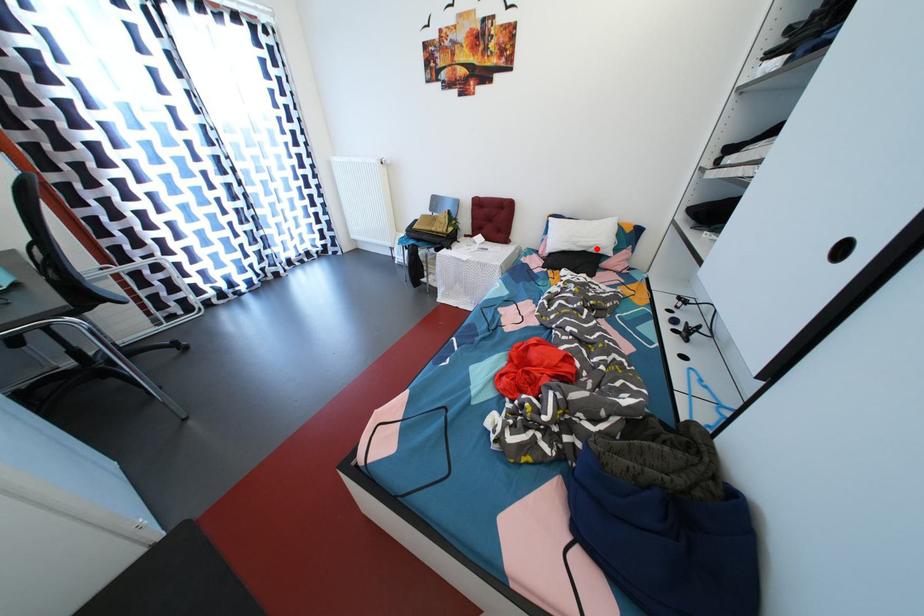
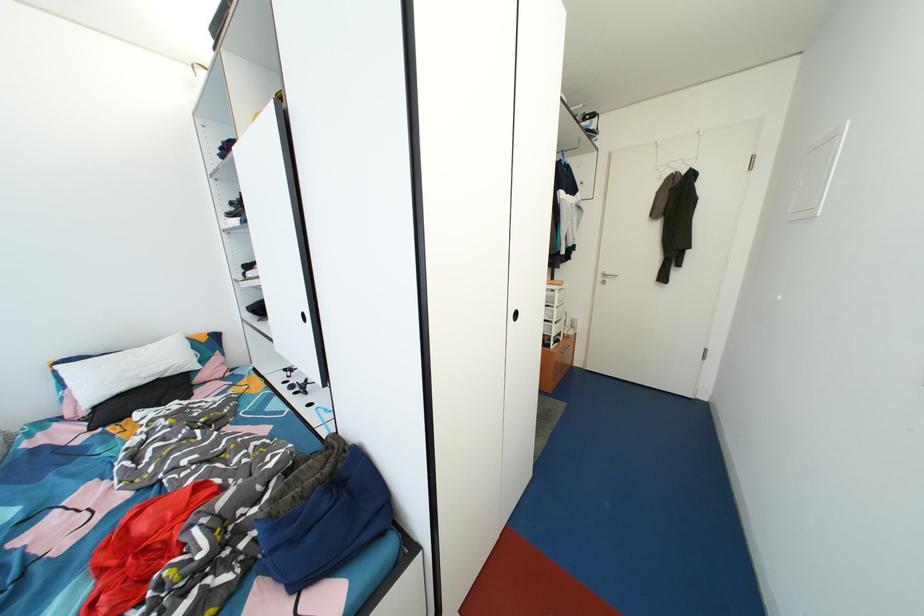
Question: I am providing you with two images of the same scene from different viewpoints. A red point is marked on the first image. At the location where the point appears in image 1, is it still visible in image 2?

Choices:
 (A) Yes
 (B) No

Answer: (A)